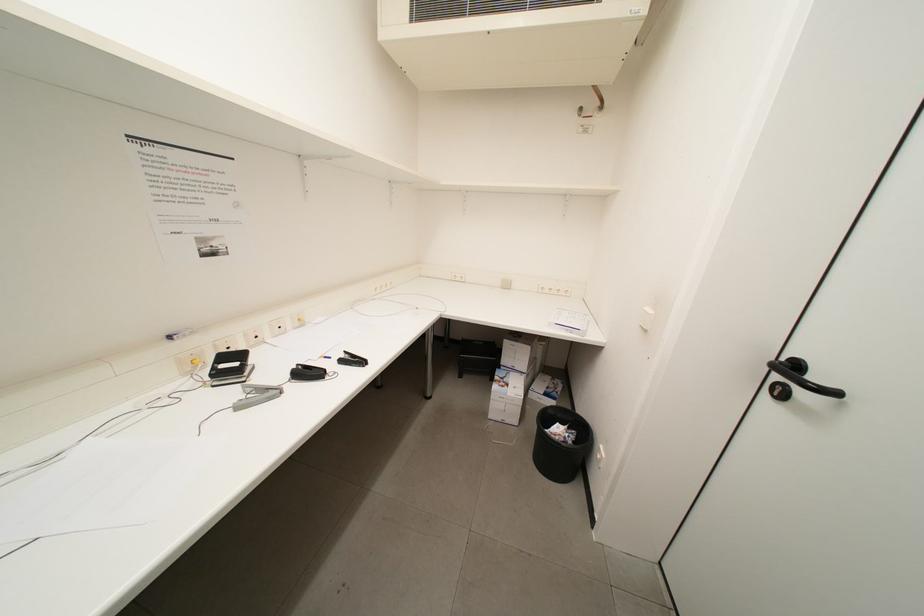
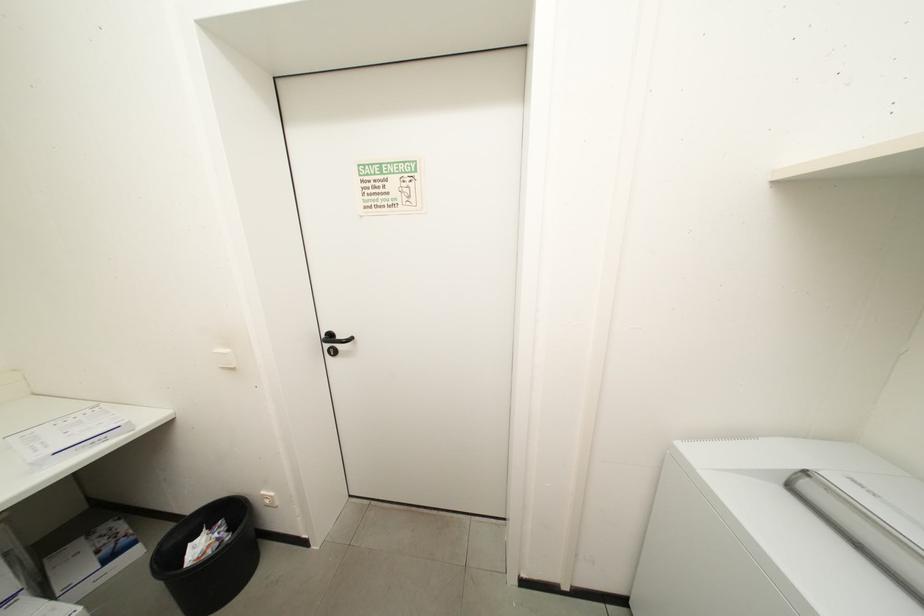
How did the camera likely rotate?

The camera's rotation is toward right-down.